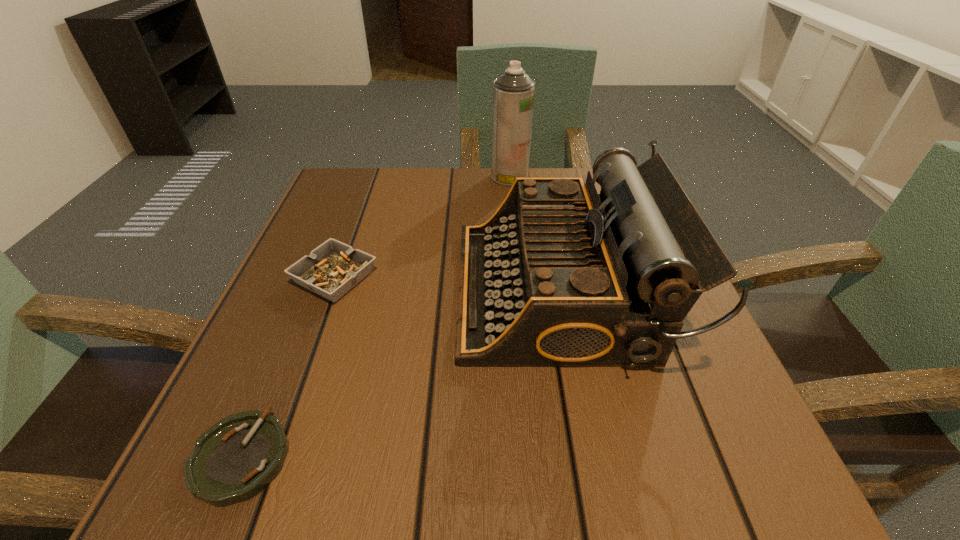
The height and width of the screenshot is (540, 960). Identify the location of vacant region at the near right corner of the desktop. (718, 504).

Identify the location of vacant region between the aerosol can and the third tallest object. Image resolution: width=960 pixels, height=540 pixels. (422, 228).

I want to click on free space between the third shortest object and the taller ashtray, so click(x=448, y=285).

The width and height of the screenshot is (960, 540). In order to click on free space that is in between the farthest object and the shortest object in this screenshot , I will do `click(375, 317)`.

Find the location of a particular element. The width and height of the screenshot is (960, 540). vacant area that lies between the nearest object and the third shortest object is located at coordinates pyautogui.click(x=401, y=374).

Where is `free space that is in between the shorter ashtray and the tallest object`? The width and height of the screenshot is (960, 540). free space that is in between the shorter ashtray and the tallest object is located at coordinates (375, 317).

The image size is (960, 540). What are the coordinates of `free space between the nearer ashtray and the second shortest object` in the screenshot? It's located at click(x=288, y=367).

At what (x,y) coordinates should I click in order to perform the action: click on object that stands as the second closest to the taller ashtray. Please return your answer as a coordinate pair (x, y). Looking at the image, I should click on (236, 458).

The height and width of the screenshot is (540, 960). I want to click on the closest object to the typewriter, so click(332, 269).